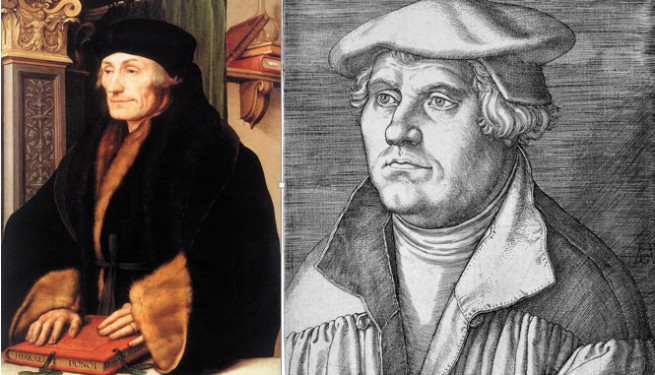
Locate an element on the screen. The width and height of the screenshot is (655, 375). sconces is located at coordinates (48, 87).